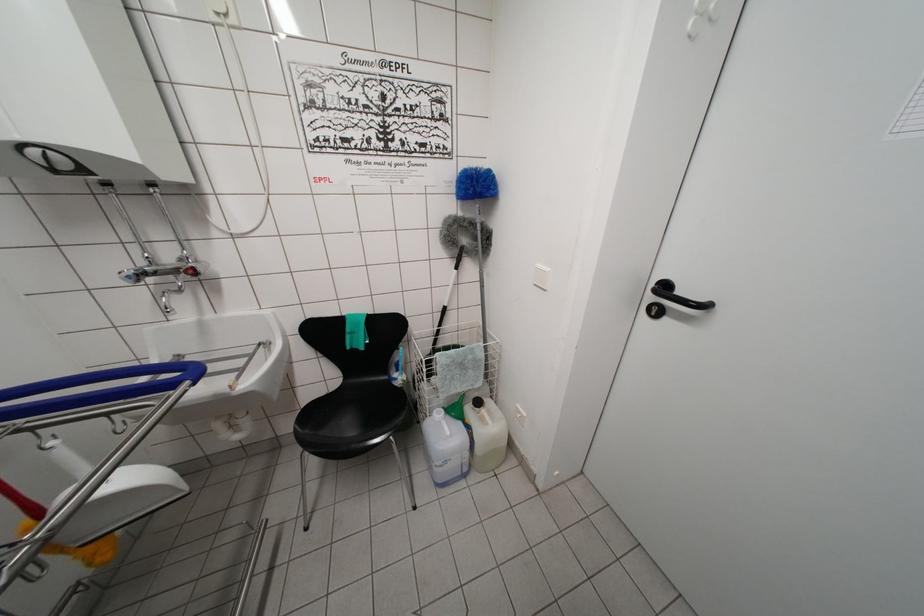
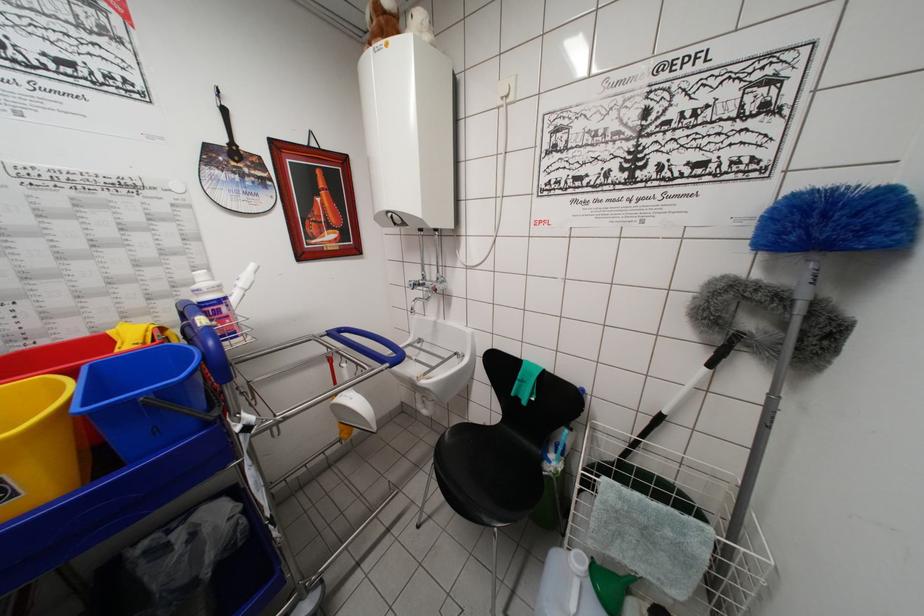
Question: The camera is either moving clockwise (left) or counter-clockwise (right) around the object. The first image is from the beginning of the video and the second image is from the end. Is the camera moving left or right when shooting the video?

Choices:
 (A) Left
 (B) Right

Answer: (B)